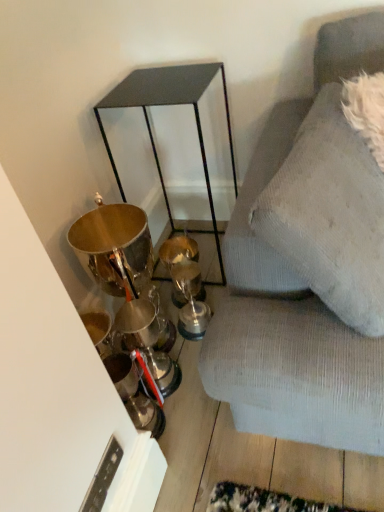
Describe the element at coordinates (171, 105) in the screenshot. The width and height of the screenshot is (384, 512). I see `matte black side table at center` at that location.

Identify the location of matte black side table at center. The height and width of the screenshot is (512, 384). [171, 105].

The height and width of the screenshot is (512, 384). I want to click on matte black side table at center, so click(171, 105).